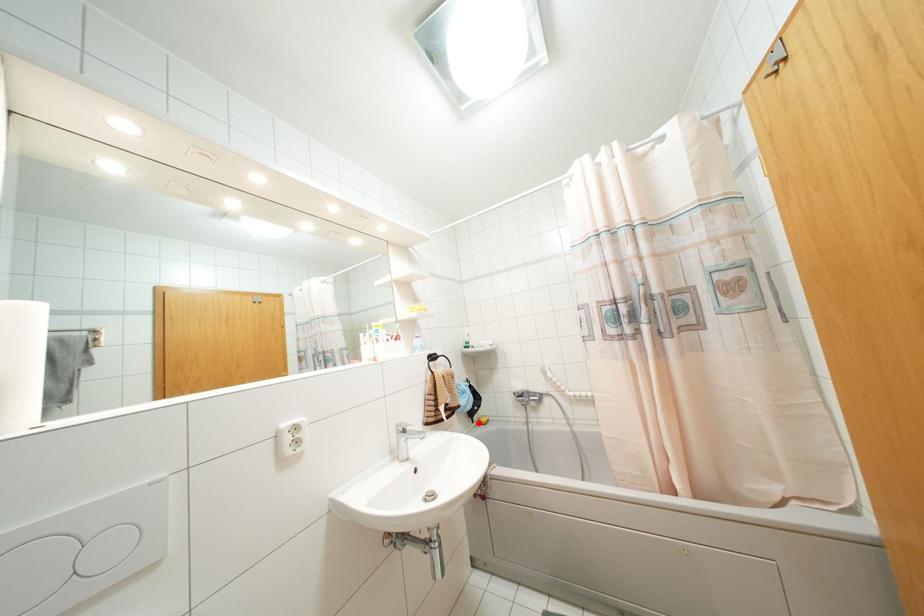
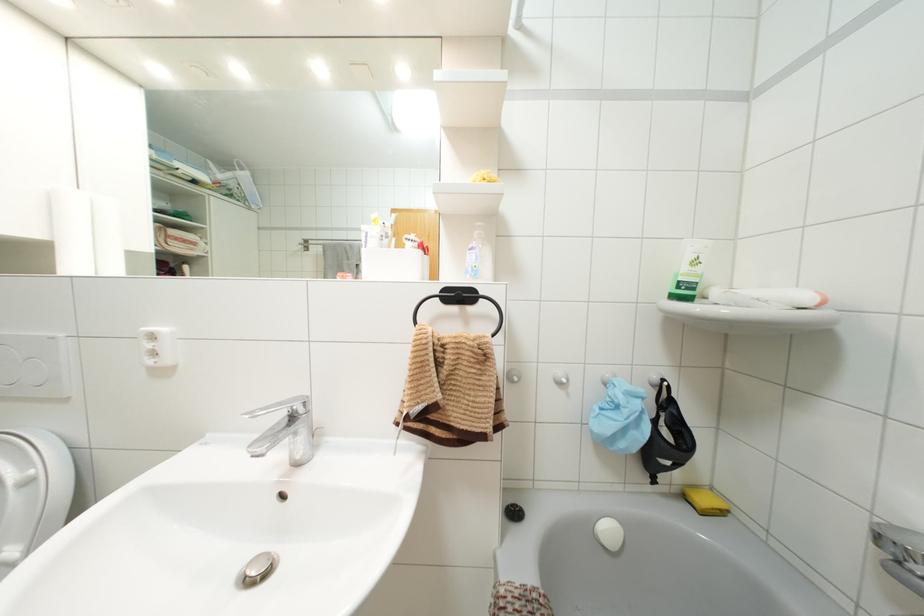
Locate, in the second image, the point that corresponds to the highlighted location in the first image.

(685, 496)